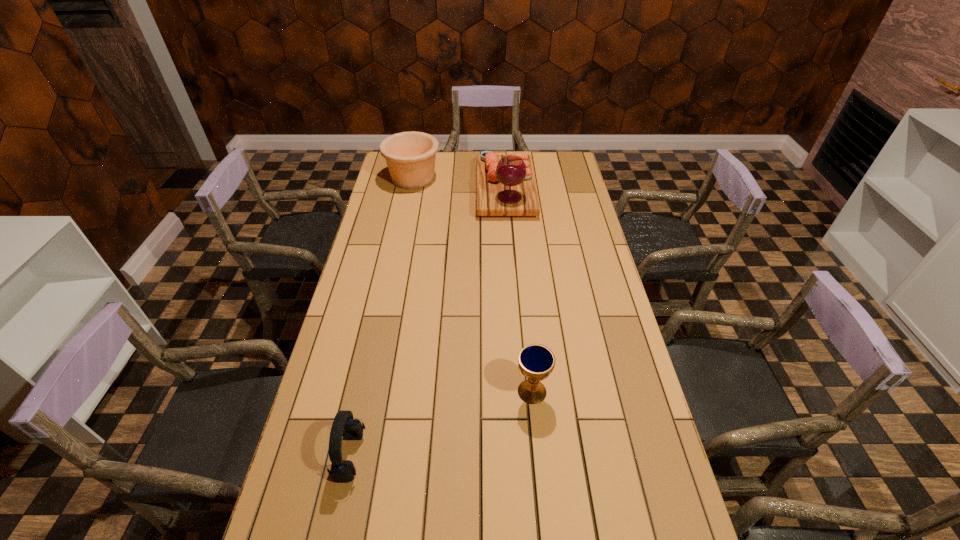
What are the coordinates of `pottery at the left edge` in the screenshot? It's located at (410, 156).

Locate an element on the screen. The width and height of the screenshot is (960, 540). headset positioned at the left edge is located at coordinates (344, 425).

Locate an element on the screen. object that is at the far left corner is located at coordinates (410, 156).

At what (x,y) coordinates should I click in order to perform the action: click on vacant position at the far edge of the desktop. Please return your answer as a coordinate pair (x, y). Looking at the image, I should click on (475, 154).

In the image, there is a desktop. In order to click on vacant area at the left edge in this screenshot , I will do `click(300, 488)`.

This screenshot has width=960, height=540. I want to click on free space at the right edge of the desktop, so click(x=634, y=485).

You are a GUI agent. You are given a task and a screenshot of the screen. Output one action in this format:
    pyautogui.click(x=<x>, y=<y>)
    Task: Click on the vacant region at the far right corner of the desktop
    Image resolution: width=960 pixels, height=540 pixels.
    Given the screenshot: What is the action you would take?
    pos(548,164)

Identify the location of blank region between the headset and the pottery. The width and height of the screenshot is (960, 540). (382, 317).

Locate an element on the screen. The image size is (960, 540). vacant region between the third farthest object and the tallest object is located at coordinates (518, 291).

Where is `empty space that is in between the third farthest object and the nearest object`? empty space that is in between the third farthest object and the nearest object is located at coordinates (442, 423).